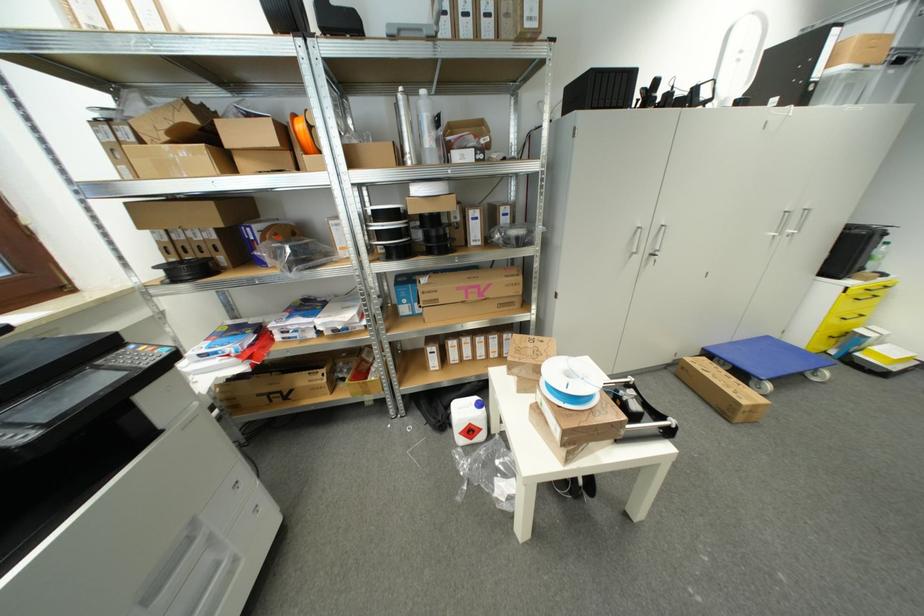
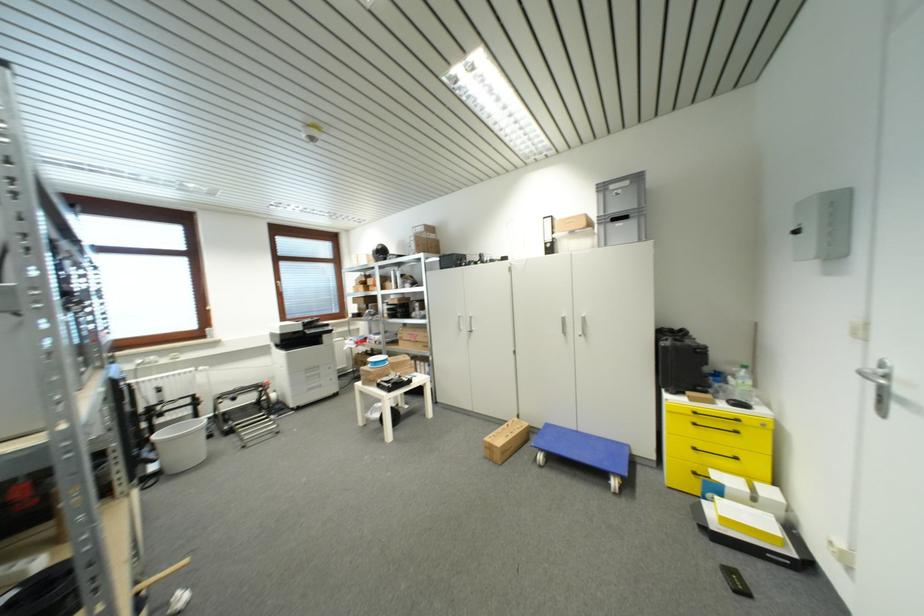
Locate, in the second image, the point that corresponds to point 708,352 in the first image.

(552, 427)